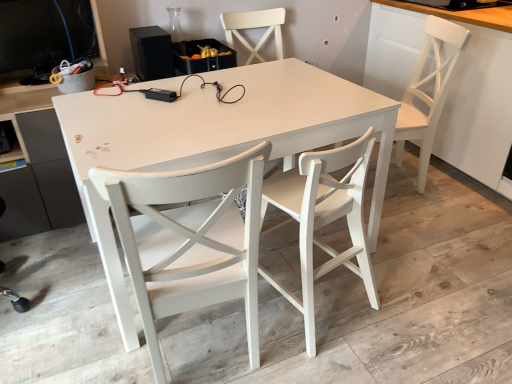
Find the location of a particular element. The width and height of the screenshot is (512, 384). vacant region to the left of white painted wood chair at center, which ranks as the 3th chair in right-to-left order is located at coordinates (80, 334).